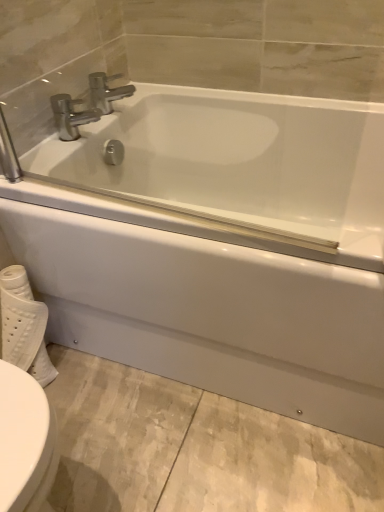
Question: Is polished chrome faucet at upper left, the 1th tap in the bottom-to-top sequence, situated inside polished chrome faucet at upper center, placed as the second tap when sorted from bottom to top, or outside?

Choices:
 (A) outside
 (B) inside

Answer: (A)

Question: From their relative heights in the image, would you say polished chrome faucet at upper left, the 1th tap in the bottom-to-top sequence, is taller or shorter than polished chrome faucet at upper center, placed as the second tap when sorted from bottom to top?

Choices:
 (A) short
 (B) tall

Answer: (B)

Question: Estimate the real-world distances between objects in this image. Which object is closer to the polished chrome faucet at upper center, placed as the second tap when sorted from bottom to top?

Choices:
 (A) white textured toilet paper at lower left
 (B) polished chrome faucet at upper left, the 1th tap in the bottom-to-top sequence
 (C) white glossy bathtub at center

Answer: (B)

Question: Which object is the closest to the polished chrome faucet at upper center, which ranks as the 1th tap in top-to-bottom order?

Choices:
 (A) white glossy bathtub at center
 (B) white textured toilet paper at lower left
 (C) polished chrome faucet at upper left, the 1th tap in the bottom-to-top sequence

Answer: (C)